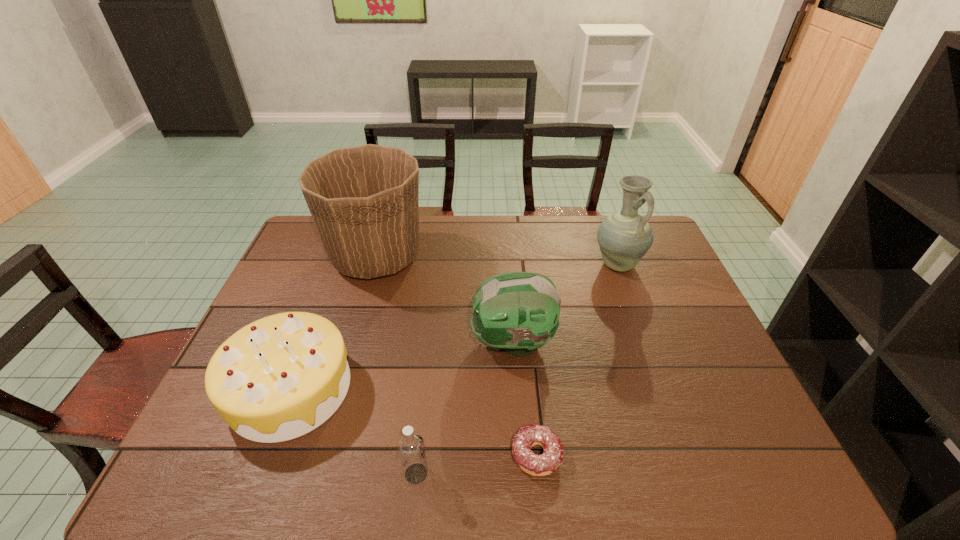
Image resolution: width=960 pixels, height=540 pixels. In order to click on birthday cake that is positioned at the left edge in this screenshot , I will do `click(280, 377)`.

Where is `object positioned at the right edge`? Image resolution: width=960 pixels, height=540 pixels. object positioned at the right edge is located at coordinates (624, 237).

Where is `object that is positioned at the far left corner`? The image size is (960, 540). object that is positioned at the far left corner is located at coordinates (363, 200).

Locate an element on the screen. This screenshot has height=540, width=960. object that is positioned at the near left corner is located at coordinates (280, 377).

You are a GUI agent. You are given a task and a screenshot of the screen. Output one action in this format:
    pyautogui.click(x=<x>, y=<y>)
    Task: Click on the object located in the far right corner section of the desktop
    The width and height of the screenshot is (960, 540).
    Given the screenshot: What is the action you would take?
    pyautogui.click(x=624, y=237)

Locate an element on the screen. Image resolution: width=960 pixels, height=540 pixels. vacant space at the far edge is located at coordinates (588, 217).

In the image, there is a desktop. In order to click on vacant area at the near edge in this screenshot , I will do `click(574, 468)`.

This screenshot has height=540, width=960. In the image, there is a desktop. What are the coordinates of `vacant region at the right edge` in the screenshot? It's located at (656, 277).

Locate an element on the screen. vacant space that's between the shortest object and the birthday cake is located at coordinates (414, 422).

At what (x,y) coordinates should I click in order to perform the action: click on free area in between the shortest object and the birthday cake. Please return your answer as a coordinate pair (x, y). Looking at the image, I should click on (414, 422).